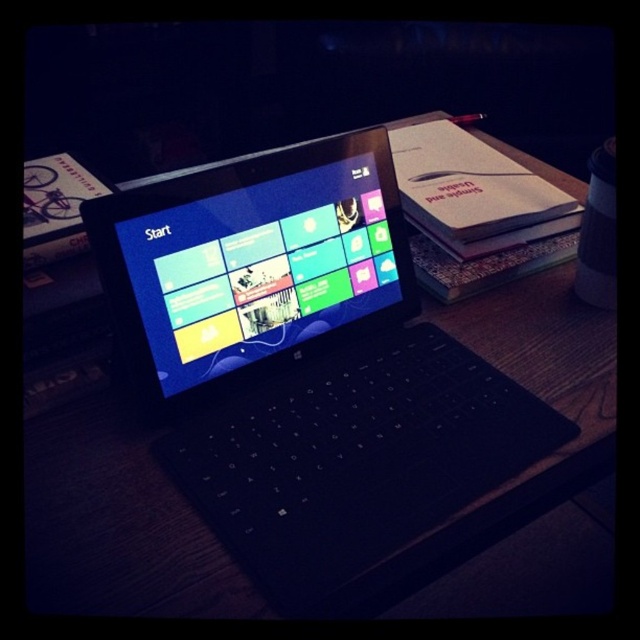
Question: Which object appears farthest from the camera in this image?

Choices:
 (A) black matte laptop at center
 (B) matte plastic screen at center

Answer: (B)

Question: Can you confirm if black matte laptop at center is positioned below matte plastic screen at center?

Choices:
 (A) yes
 (B) no

Answer: (A)

Question: Can you confirm if black matte laptop at center is thinner than matte plastic screen at center?

Choices:
 (A) no
 (B) yes

Answer: (A)

Question: Can you confirm if black matte laptop at center is smaller than matte plastic screen at center?

Choices:
 (A) no
 (B) yes

Answer: (A)